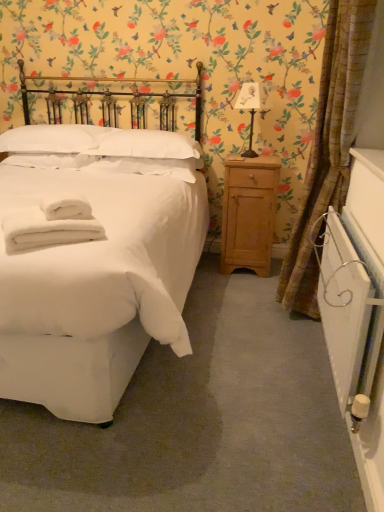
You are a GUI agent. You are given a task and a screenshot of the screen. Output one action in this format:
    pyautogui.click(x=<x>, y=<y>)
    Task: Click on the free space to the left of textured beige curtain at right
    This screenshot has width=384, height=512.
    Given the screenshot: What is the action you would take?
    pyautogui.click(x=230, y=332)